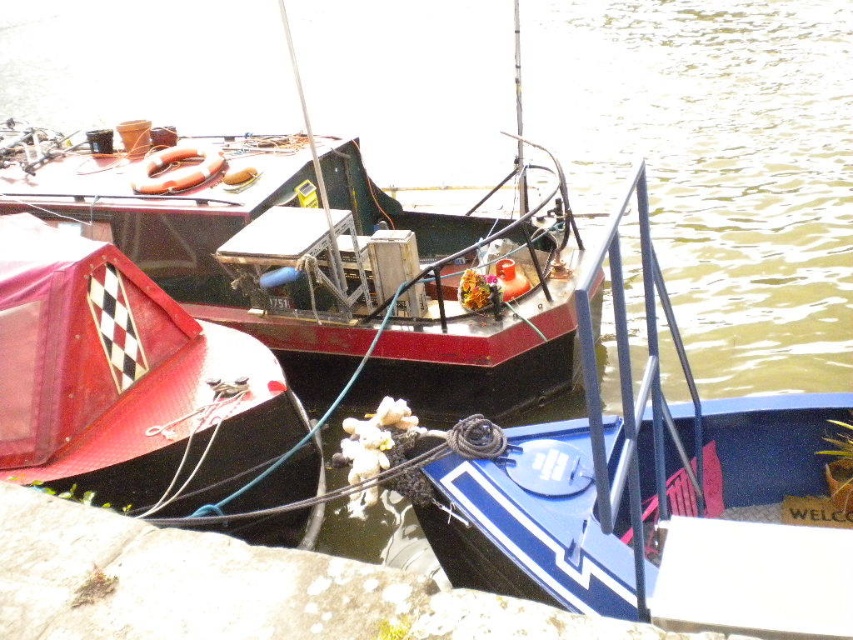
Between point (10, 211) and point (843, 541), which one is positioned behind?

The point (10, 211) is more distant.

The height and width of the screenshot is (640, 853). Find the location of `matte red boat at left`. matte red boat at left is located at coordinates (325, 253).

Who is more distant from viewer, (395, 256) or (45, 442)?

Point (395, 256)

Is point (149, 150) closer to viewer compared to point (109, 256)?

No, (149, 150) is further to viewer.

Is point (425, 232) positioned in front of point (4, 400)?

No, it is behind (4, 400).

This screenshot has width=853, height=640. What are the coordinates of `matte red boat at left` in the screenshot? It's located at (325, 253).

Is blue glossy boat at center bigger than red matte boat at left?

Yes.

Can you confirm if blue glossy boat at center is positioned below red matte boat at left?

Indeed, blue glossy boat at center is positioned under red matte boat at left.

Locate an element on the screen. The image size is (853, 640). blue glossy boat at center is located at coordinates (659, 496).